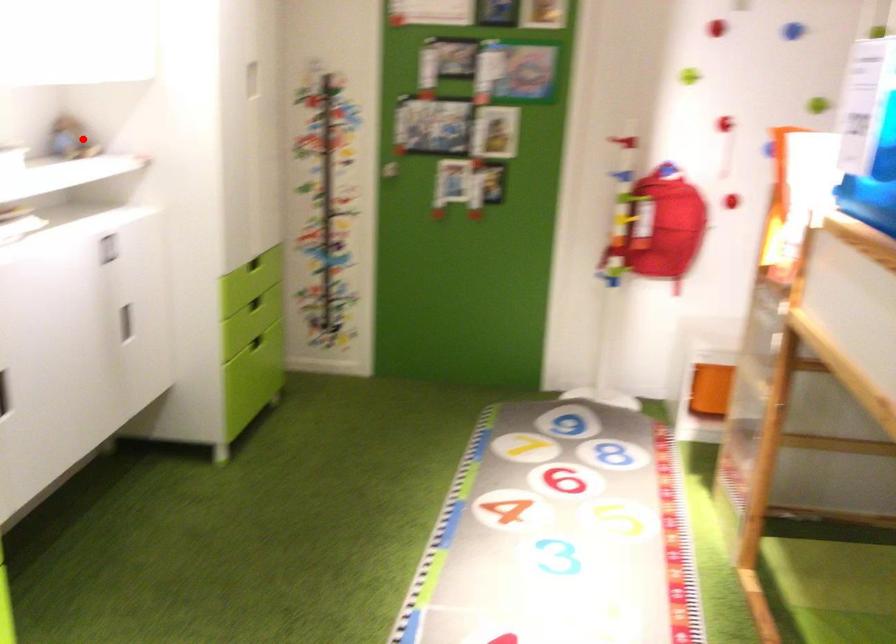
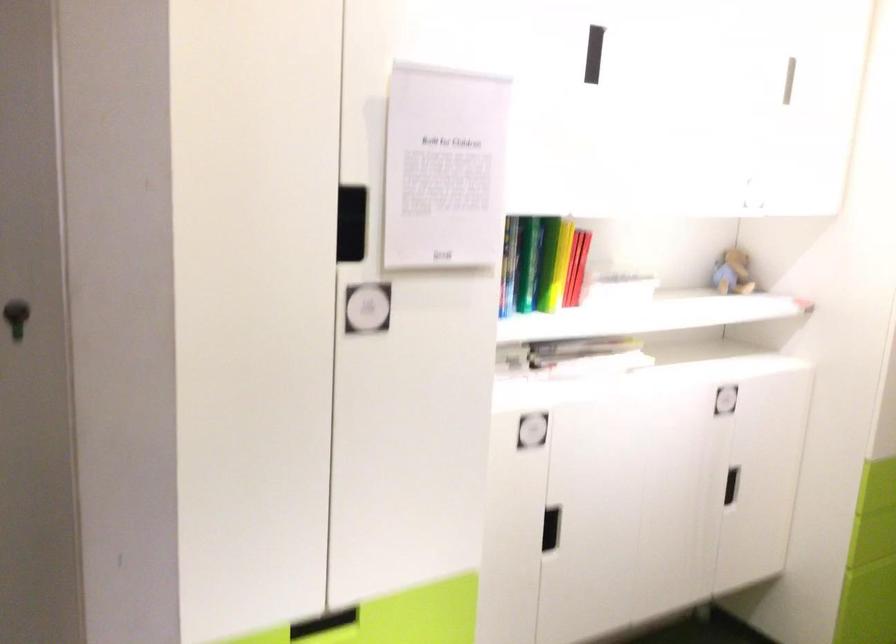
Where in the second image is the point corresponding to the highlighted location from the first image?

(733, 272)